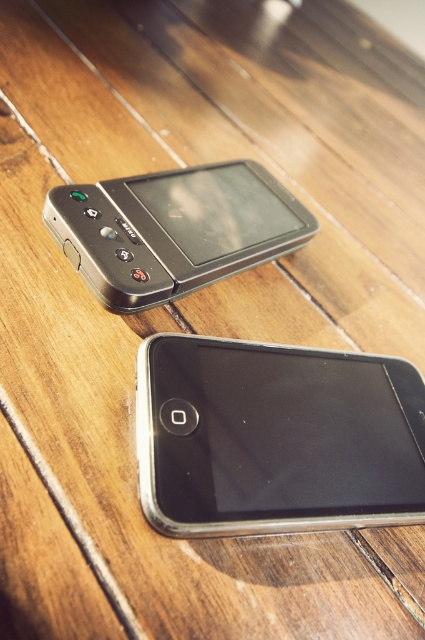
You are looking at two points on a wooden table. The first point is at coordinates point (289, 365) and the second is at point (164, 189). Which point is closer to you?

Point (289, 365) is in front of point (164, 189), so it is closer to you.

You are organizing a display of old phones and need to place the black plastic smartphone at center and the matte black phone at upper center on a shelf. If the shelf has limited space, which phone should you place first to ensure both fit?

The black plastic smartphone at center occupies less space than the matte black phone at upper center, so you should place the matte black phone at upper center first to accommodate its larger size, then fit the smaller black plastic smartphone at center next.

In the scene shown: You are holding a small toy car that is 3 inches long and want to place it between the black plastic smartphone at center and the matte black phone at upper center. Can the toy car fit in the space between them?

The black plastic smartphone at center is closer to the viewer than the matte black phone at upper center, so the space between them is sufficient to fit a 3 inch toy car.